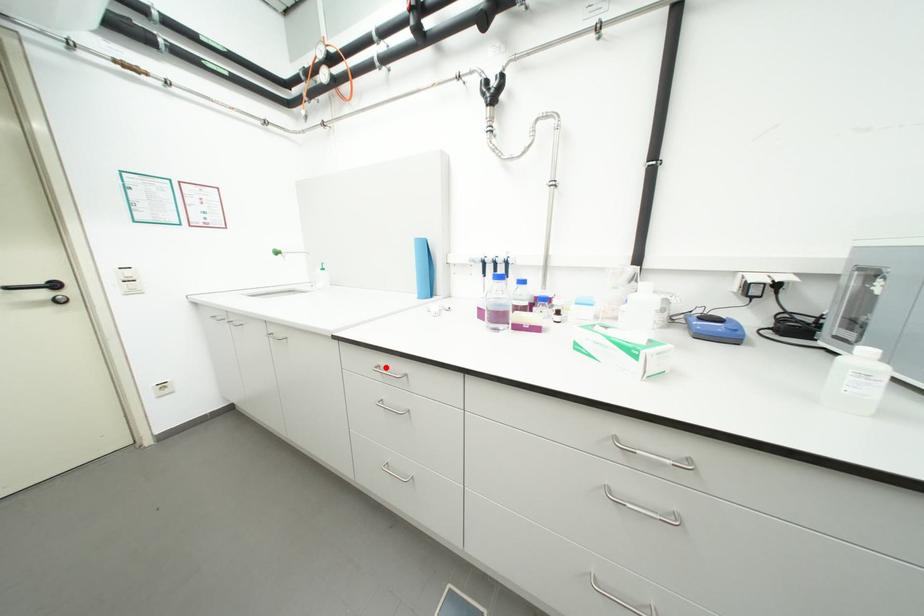
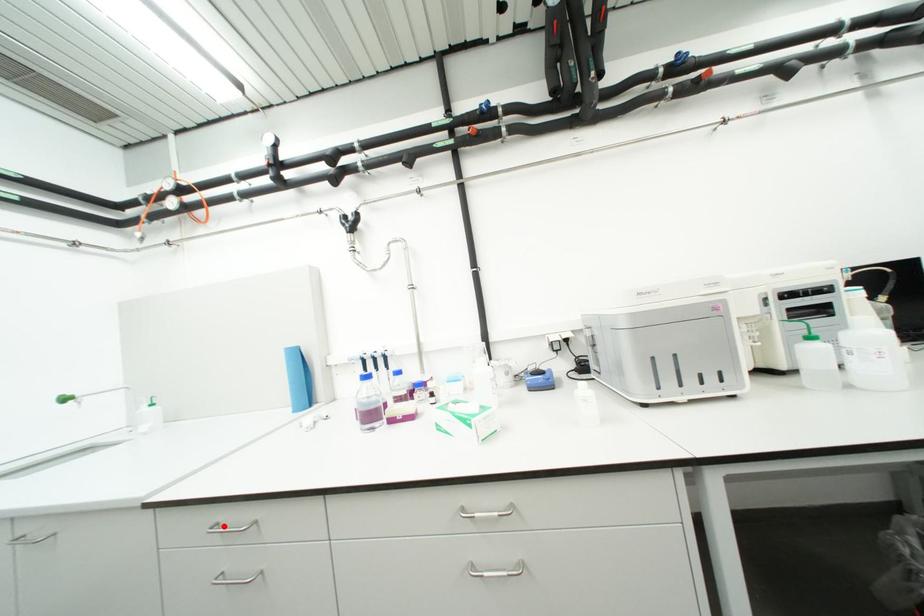
I am providing you with two images of the same scene from different viewpoints. A red point is marked on the first image and another point is marked on the second image. Does the point marked in image1 correspond to the same location as the one in image2?

Yes